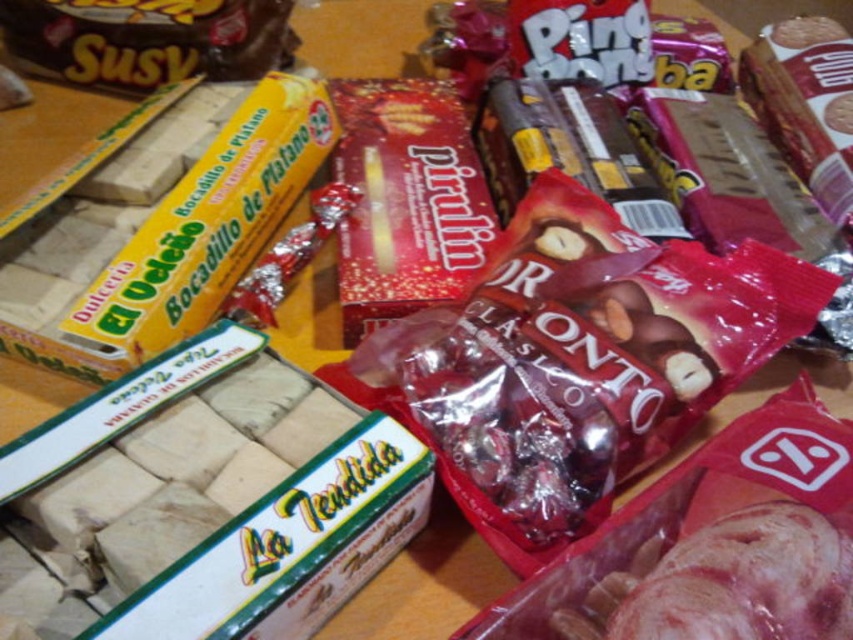
Who is positioned more to the right, marbled pinkish-red meat at lower right or brown matte chocolate bar at upper left?

marbled pinkish-red meat at lower right is more to the right.

Can you confirm if marbled pinkish-red meat at lower right is positioned below brown matte chocolate bar at upper left?

Indeed, marbled pinkish-red meat at lower right is positioned under brown matte chocolate bar at upper left.

Is point (616, 608) farther from camera compared to point (32, 10)?

No.

Where is `marbled pinkish-red meat at lower right`? Image resolution: width=853 pixels, height=640 pixels. marbled pinkish-red meat at lower right is located at coordinates (730, 582).